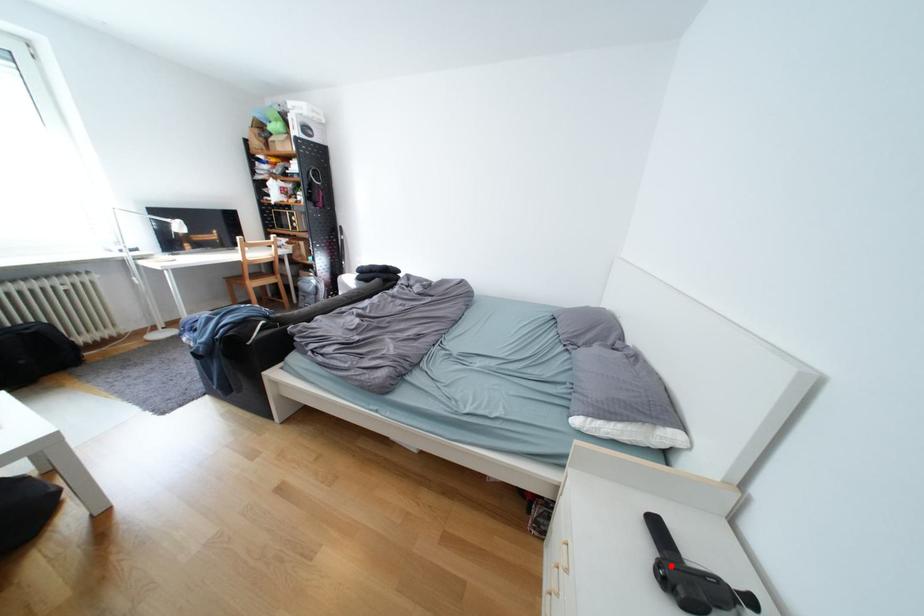
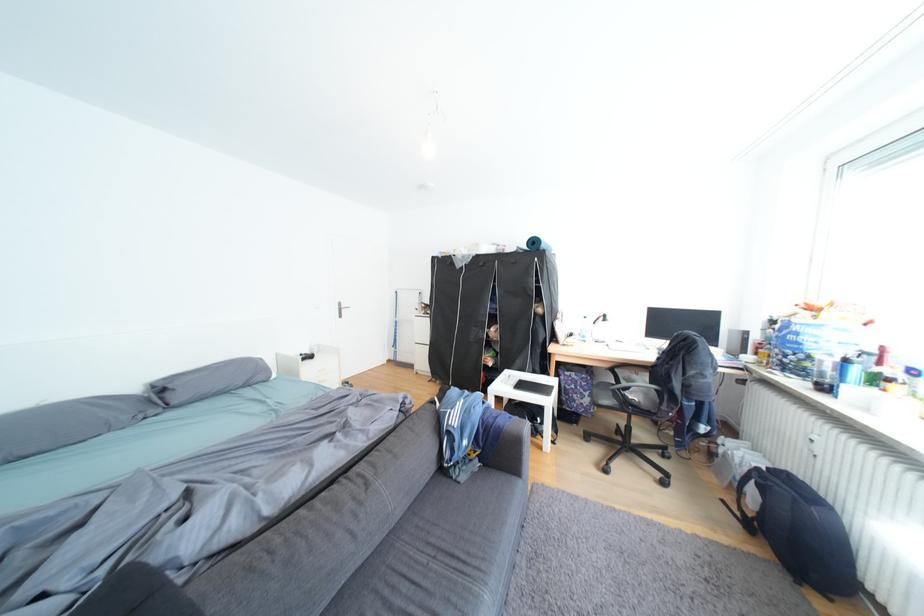
Question: I am providing you with two images of the same scene from different viewpoints. A red point is marked on the first image. Is the red point's position out of view in image 2?

Choices:
 (A) Yes
 (B) No

Answer: (A)